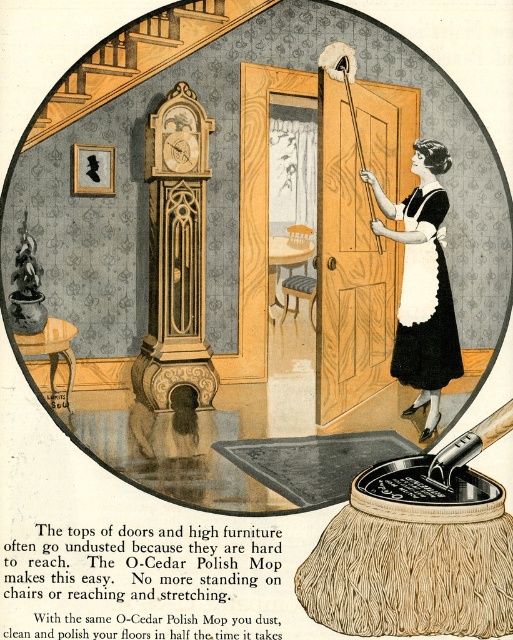
Question: Which object is the closest to the white cotton apron at center?

Choices:
 (A) black cotton apron at upper right
 (B) wooden carved clock at center

Answer: (A)

Question: Which object is closer to the camera taking this photo?

Choices:
 (A) white cotton apron at center
 (B) wooden carved clock at center
 (C) black cotton apron at upper right

Answer: (C)

Question: Observing the image, what is the correct spatial positioning of wooden carved clock at center in reference to black cotton apron at upper right?

Choices:
 (A) left
 (B) right

Answer: (A)

Question: Which point is farther to the camera?

Choices:
 (A) (438, 285)
 (B) (155, 227)
 (C) (406, 276)
 (D) (403, 269)

Answer: (D)

Question: Can you confirm if wooden carved clock at center is positioned to the left of white cotton apron at right?

Choices:
 (A) yes
 (B) no

Answer: (A)

Question: Does black cotton apron at upper right come behind white cotton apron at right?

Choices:
 (A) yes
 (B) no

Answer: (B)